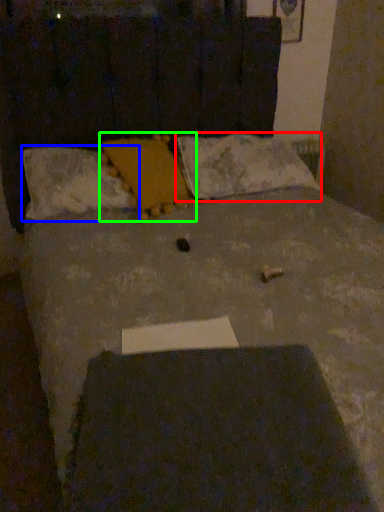
Question: Estimate the real-world distances between objects in this image. Which object is closer to pillow (highlighted by a red box), pillow (highlighted by a blue box) or pillow (highlighted by a green box)?

Choices:
 (A) pillow
 (B) pillow

Answer: (B)